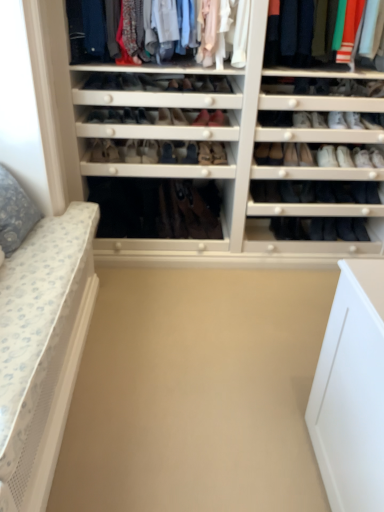
Question: From the image's perspective, would you say black leather shoe at center, the 21th shoe when ordered from left to right, is positioned over black leather shoe at center, which is the 2th shoe from right to left?

Choices:
 (A) no
 (B) yes

Answer: (B)

Question: Is black leather shoe at center, which ranks as the third shoe in right-to-left order, with black leather shoe at center, the 22th shoe viewed from the left?

Choices:
 (A) yes
 (B) no

Answer: (A)

Question: Is black leather shoe at center, which ranks as the third shoe in right-to-left order, far away from black leather shoe at center, which is the 2th shoe from right to left?

Choices:
 (A) yes
 (B) no

Answer: (B)

Question: Is black leather shoe at center, which ranks as the third shoe in right-to-left order, not within black leather shoe at center, which is the 2th shoe from right to left?

Choices:
 (A) no
 (B) yes

Answer: (B)

Question: Is black leather shoe at center, the 21th shoe when ordered from left to right, shorter than black leather shoe at center, the 22th shoe viewed from the left?

Choices:
 (A) no
 (B) yes

Answer: (B)

Question: Is black leather shoe at center, which ranks as the third shoe in right-to-left order, positioned with its back to black leather shoe at center, the 22th shoe viewed from the left?

Choices:
 (A) yes
 (B) no

Answer: (B)

Question: Is leather brown shoe at center, the eleventh shoe viewed from the right, at the right side of black leather shoe at center, which ranks as the third shoe in right-to-left order?

Choices:
 (A) no
 (B) yes

Answer: (A)

Question: Is leather brown shoe at center, the eleventh shoe viewed from the right, bigger than black leather shoe at center, the 21th shoe when ordered from left to right?

Choices:
 (A) yes
 (B) no

Answer: (A)

Question: From the image's perspective, is leather brown shoe at center, arranged as the 13th shoe when viewed from the left, over black leather shoe at center, which ranks as the third shoe in right-to-left order?

Choices:
 (A) yes
 (B) no

Answer: (A)

Question: Is leather brown shoe at center, the eleventh shoe viewed from the right, not inside black leather shoe at center, which ranks as the third shoe in right-to-left order?

Choices:
 (A) no
 (B) yes

Answer: (B)

Question: Considering the relative sizes of leather brown shoe at center, the eleventh shoe viewed from the right, and black leather shoe at center, the 21th shoe when ordered from left to right, in the image provided, is leather brown shoe at center, the eleventh shoe viewed from the right, smaller than black leather shoe at center, the 21th shoe when ordered from left to right,?

Choices:
 (A) no
 (B) yes

Answer: (A)

Question: Considering the relative positions of beige matte plain at center and matte black shoe at center, marked as the 12th shoe in a left-to-right arrangement, in the image provided, is beige matte plain at center in front of matte black shoe at center, marked as the 12th shoe in a left-to-right arrangement,?

Choices:
 (A) yes
 (B) no

Answer: (A)